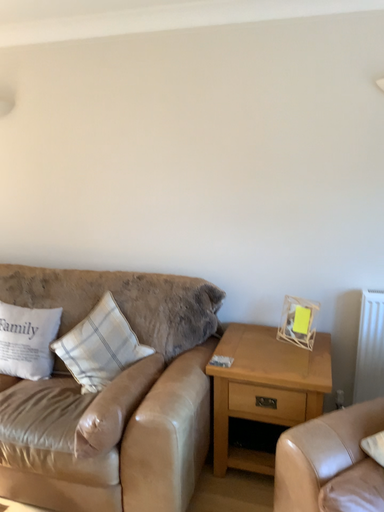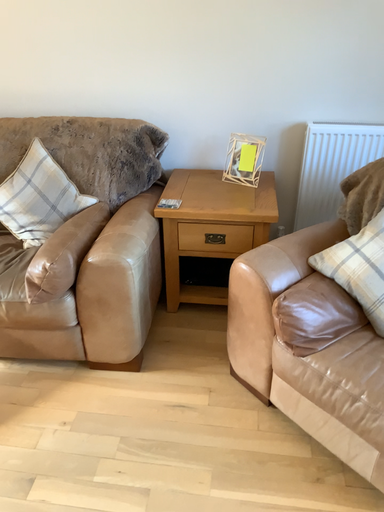
Question: Which way did the camera rotate in the video?

Choices:
 (A) rotated downward
 (B) rotated upward

Answer: (A)